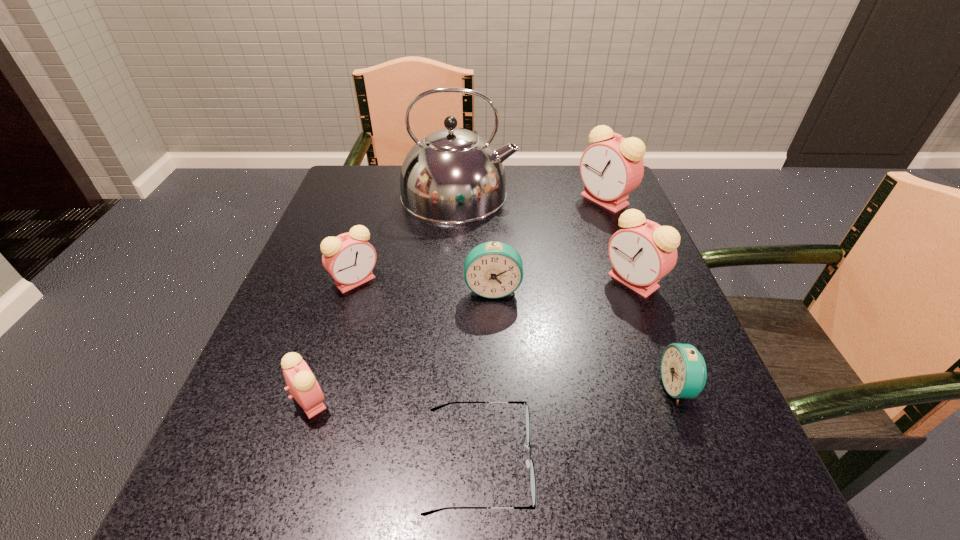
In order to click on free space that is in between the fourth alarm clock from right to left and the smallest pink alarm clock in this screenshot , I will do [402, 345].

This screenshot has width=960, height=540. In order to click on vacant space that's between the shortest object and the left blue alarm clock in this screenshot , I will do `click(486, 376)`.

Identify the location of free spot between the smallest pink alarm clock and the bigger blue alarm clock. This screenshot has height=540, width=960. (402, 345).

In order to click on free space between the farthest pink alarm clock and the black spectacles in this screenshot , I will do `click(541, 331)`.

The height and width of the screenshot is (540, 960). Find the location of `object that is the seventh closest one to the farther blue alarm clock`. object that is the seventh closest one to the farther blue alarm clock is located at coordinates (610, 169).

Identify which object is the nearest to the kettle. Please provide its 2D coordinates. Your answer should be formatted as a tuple, i.e. [(x, y)], where the tuple contains the x and y coordinates of a point satisfying the conditions above.

[(349, 258)]

Find the location of a particular element. the closest alarm clock to the second smallest pink alarm clock is located at coordinates (493, 269).

Identify which alarm clock is located as the second nearest to the left blue alarm clock. Please provide its 2D coordinates. Your answer should be formatted as a tuple, i.e. [(x, y)], where the tuple contains the x and y coordinates of a point satisfying the conditions above.

[(349, 258)]

Find the location of a particular element. Image resolution: width=960 pixels, height=540 pixels. the second closest pink alarm clock to the second smallest pink alarm clock is located at coordinates (642, 252).

The width and height of the screenshot is (960, 540). Find the location of `pink alarm clock that stands as the third closest to the kettle`. pink alarm clock that stands as the third closest to the kettle is located at coordinates (642, 252).